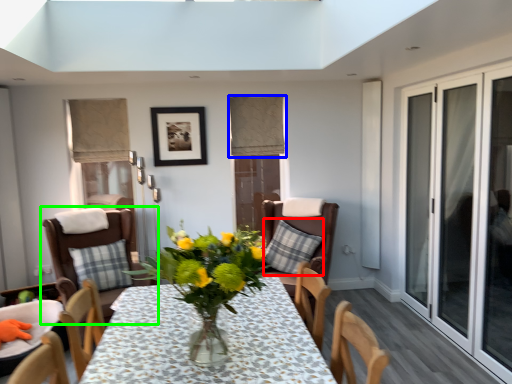
Question: Estimate the real-world distances between objects in this image. Which object is closer to pillow (highlighted by a red box), curtain (highlighted by a blue box) or chair (highlighted by a green box)?

Choices:
 (A) curtain
 (B) chair

Answer: (A)